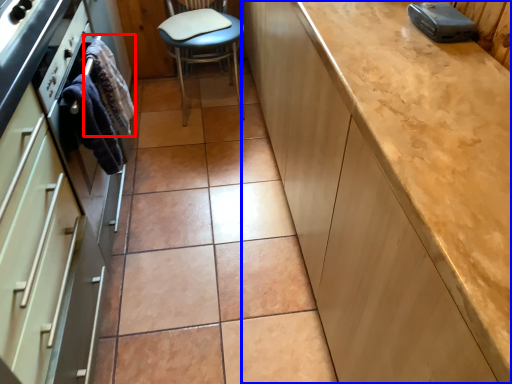
Question: Which of the following is the farthest to the observer, material (highlighted by a red box) or cabinetry (highlighted by a blue box)?

Choices:
 (A) material
 (B) cabinetry

Answer: (A)